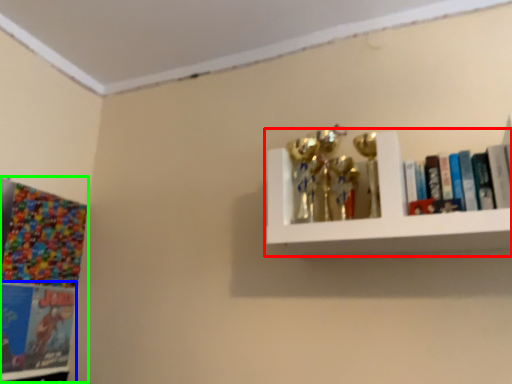
Question: Which is farther away from shelf (highlighted by a red box)? book (highlighted by a blue box) or comic book (highlighted by a green box)?

Choices:
 (A) book
 (B) comic book

Answer: (A)